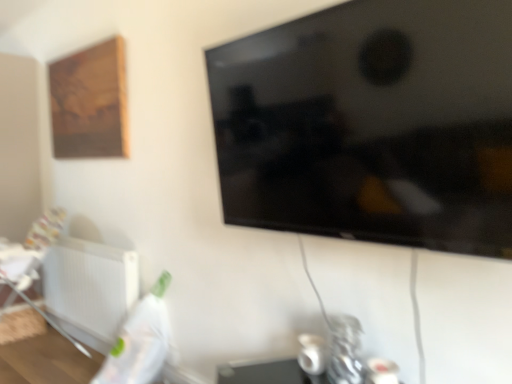
Question: Considering the relative sizes of black glossy tv at upper center and wooden picture frame at upper left in the image provided, is black glossy tv at upper center shorter than wooden picture frame at upper left?

Choices:
 (A) no
 (B) yes

Answer: (B)

Question: Considering the relative sizes of black glossy tv at upper center and wooden picture frame at upper left in the image provided, is black glossy tv at upper center wider than wooden picture frame at upper left?

Choices:
 (A) no
 (B) yes

Answer: (B)

Question: From a real-world perspective, is black glossy tv at upper center on wooden picture frame at upper left?

Choices:
 (A) yes
 (B) no

Answer: (B)

Question: Is black glossy tv at upper center taller than wooden picture frame at upper left?

Choices:
 (A) no
 (B) yes

Answer: (A)

Question: Is black glossy tv at upper center to the left of wooden picture frame at upper left from the viewer's perspective?

Choices:
 (A) yes
 (B) no

Answer: (B)

Question: Based on their sizes in the image, would you say black glossy tv at upper center is bigger or smaller than white plastic radiator at lower left?

Choices:
 (A) big
 (B) small

Answer: (A)

Question: Considering the positions of black glossy tv at upper center and white plastic radiator at lower left in the image, is black glossy tv at upper center taller or shorter than white plastic radiator at lower left?

Choices:
 (A) tall
 (B) short

Answer: (A)

Question: Based on their positions, is black glossy tv at upper center located to the left or right of white plastic radiator at lower left?

Choices:
 (A) left
 (B) right

Answer: (B)

Question: Is black glossy tv at upper center wider or thinner than white plastic radiator at lower left?

Choices:
 (A) wide
 (B) thin

Answer: (A)

Question: Is wooden picture frame at upper left taller or shorter than black glossy tv at upper center?

Choices:
 (A) short
 (B) tall

Answer: (B)

Question: Relative to black glossy tv at upper center, is wooden picture frame at upper left in front or behind?

Choices:
 (A) front
 (B) behind

Answer: (B)

Question: Based on their positions, is wooden picture frame at upper left located to the left or right of black glossy tv at upper center?

Choices:
 (A) right
 (B) left

Answer: (B)

Question: Is wooden picture frame at upper left spatially inside black glossy tv at upper center, or outside of it?

Choices:
 (A) outside
 (B) inside

Answer: (A)

Question: From a real-world perspective, relative to wooden picture frame at upper left, is white plastic radiator at lower left vertically above or below?

Choices:
 (A) above
 (B) below

Answer: (B)

Question: Considering the relative positions of white plastic radiator at lower left and wooden picture frame at upper left in the image provided, is white plastic radiator at lower left to the left or to the right of wooden picture frame at upper left?

Choices:
 (A) left
 (B) right

Answer: (B)